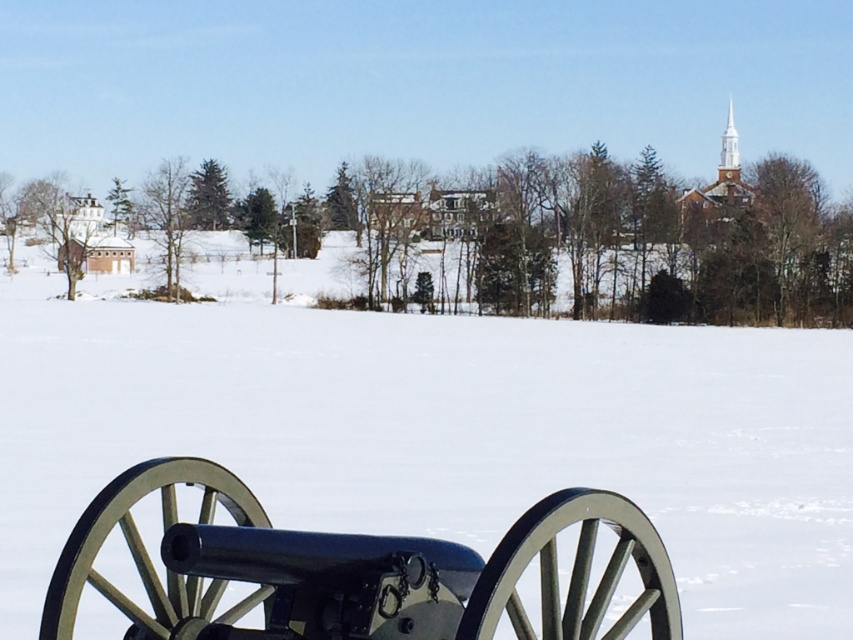
Which is in front, point (84, 580) or point (721, 134)?

Point (84, 580) is more forward.

Can you confirm if polished steel cannon at lower left is positioned to the right of white wooden steeple at upper right?

No, polished steel cannon at lower left is not to the right of white wooden steeple at upper right.

Does point (670, 625) come closer to viewer compared to point (735, 157)?

Yes, point (670, 625) is in front of point (735, 157).

Identify the location of polished steel cannon at lower left. The width and height of the screenshot is (853, 640). (352, 570).